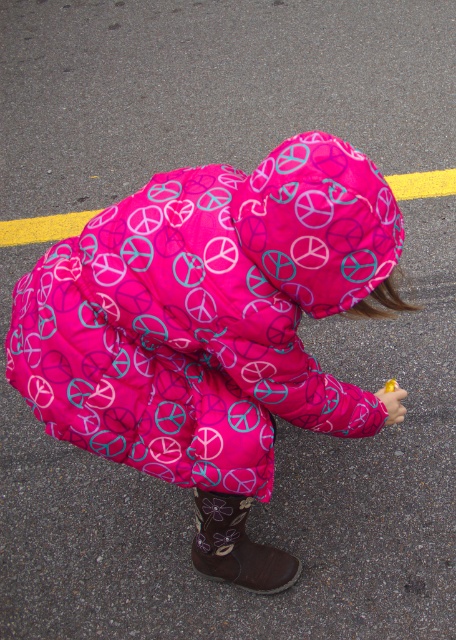
Question: Can you confirm if pink quilted coat at center is wider than yellow plastic toy at lower right?

Choices:
 (A) no
 (B) yes

Answer: (B)

Question: Where is brown suede boot at lower center located in relation to yellow matte food at lower right in the image?

Choices:
 (A) below
 (B) above

Answer: (A)

Question: Estimate the real-world distances between objects in this image. Which object is farther from the yellow plastic toy at lower right?

Choices:
 (A) yellow matte food at lower right
 (B) pink quilted coat at center

Answer: (B)

Question: Which point is closer to the camera?

Choices:
 (A) yellow plastic toy at lower right
 (B) brown suede boot at lower center

Answer: (B)

Question: From the image, what is the correct spatial relationship of yellow plastic toy at lower right in relation to yellow matte food at lower right?

Choices:
 (A) above
 (B) below

Answer: (B)

Question: Which point is farther to the camera?

Choices:
 (A) pink quilted coat at center
 (B) yellow matte food at lower right
 (C) yellow plastic toy at lower right
 (D) brown suede boot at lower center

Answer: (B)